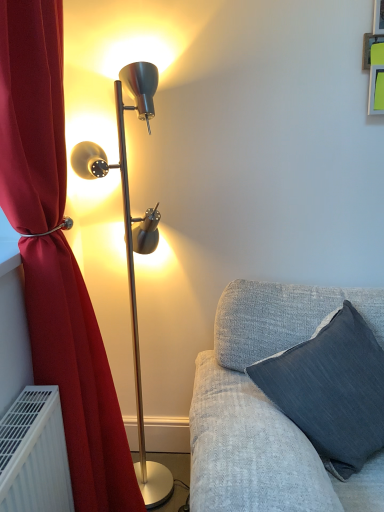
Question: Is velvet red curtain at left to the left or to the right of dark gray fabric pillow at lower right in the image?

Choices:
 (A) left
 (B) right

Answer: (A)

Question: Do you think velvet red curtain at left is within dark gray fabric pillow at lower right, or outside of it?

Choices:
 (A) inside
 (B) outside

Answer: (B)

Question: Which object is the farthest from the dark gray fabric pillow at lower right?

Choices:
 (A) metallic gold floor lamp at left
 (B) velvet red curtain at left

Answer: (A)

Question: Estimate the real-world distances between objects in this image. Which object is closer to the metallic gold floor lamp at left?

Choices:
 (A) velvet red curtain at left
 (B) dark gray fabric pillow at lower right

Answer: (A)